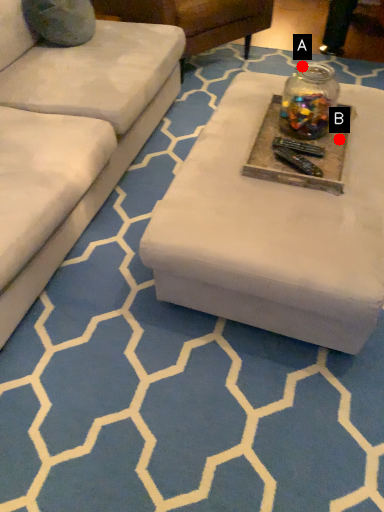
Question: Two points are circled on the image, labeled by A and B beside each circle. Which of the following is the farthest from the observer?

Choices:
 (A) A is further
 (B) B is further

Answer: (A)